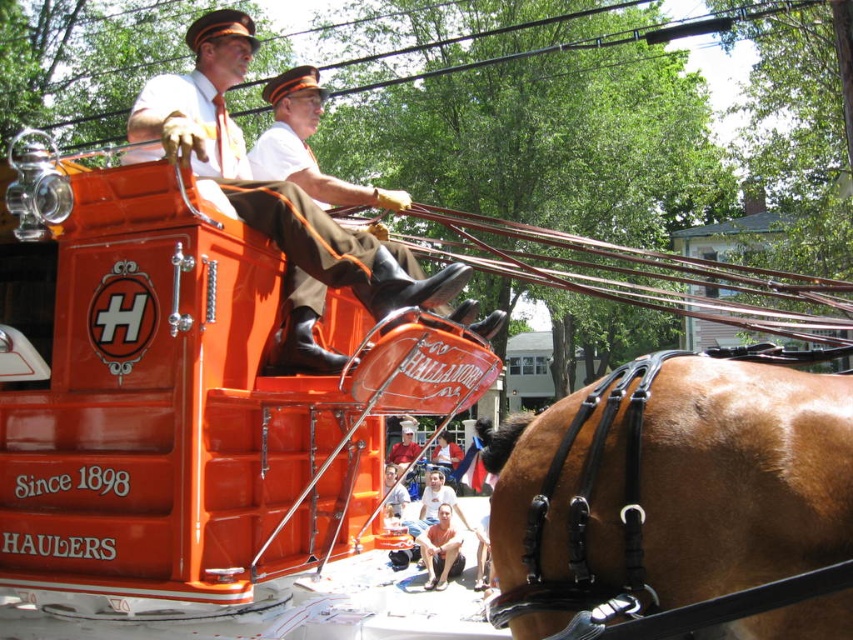
You are standing at the starting point and want to reach the destination point in the image. The two points are labeled as point (445, 312) and point (451, 456). Which point is closer to you?

Point (445, 312) is in front of point (451, 456), so it is closer to you.

You are a photographer trying to capture a clear photo of the two people in the vintage carriage. You notice the matte brown uniform at center and the smooth skin face at center. Which one should you focus on if you want to ensure the larger object is in sharp focus?

The matte brown uniform at center is larger in size than the smooth skin face at center, so you should focus on the matte brown uniform at center to ensure the larger object is in sharp focus.

You are a costume designer preparing for a historical play. You have two items from the scene described above. The first is the brown leather harness at center, and the second is the brown leather shorts at lower center. Based on their positions and sizes in the image, which item should you choose if you need an accessory that can be seen clearly from a distance?

The brown leather shorts at lower center should be chosen because they have a greater height compared to the brown leather harness at center, making them more visible from a distance.